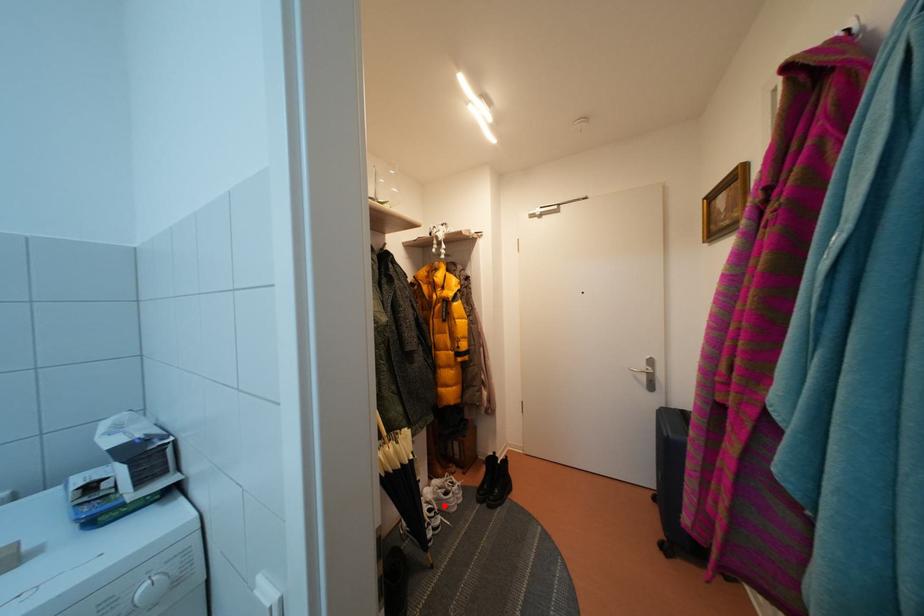
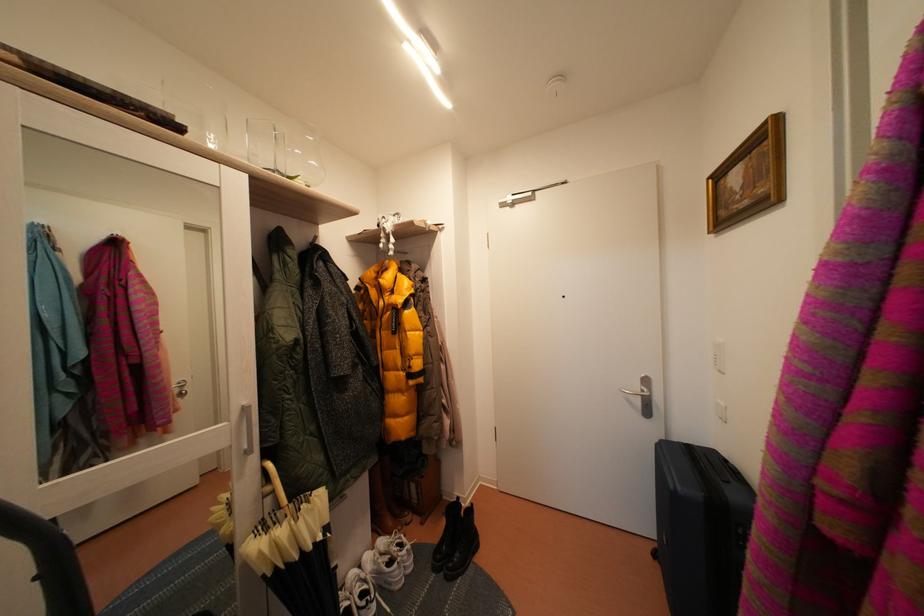
Question: A red point is marked in image1. In image2, is the corresponding 3D point closer to the camera or farther? Reply with the corresponding letter.

Choices:
 (A) The corresponding 3D point is closer.
 (B) The corresponding 3D point is farther.

Answer: (B)